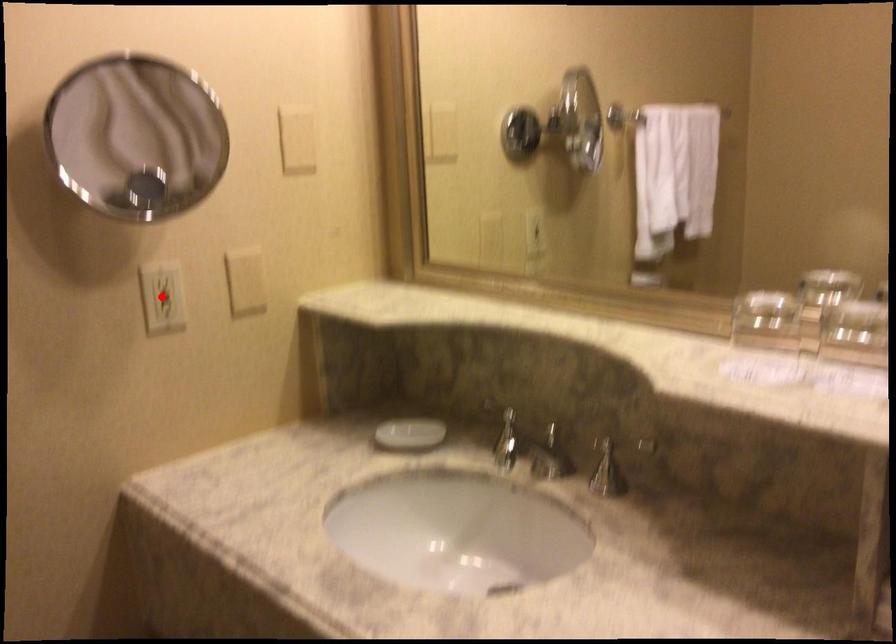
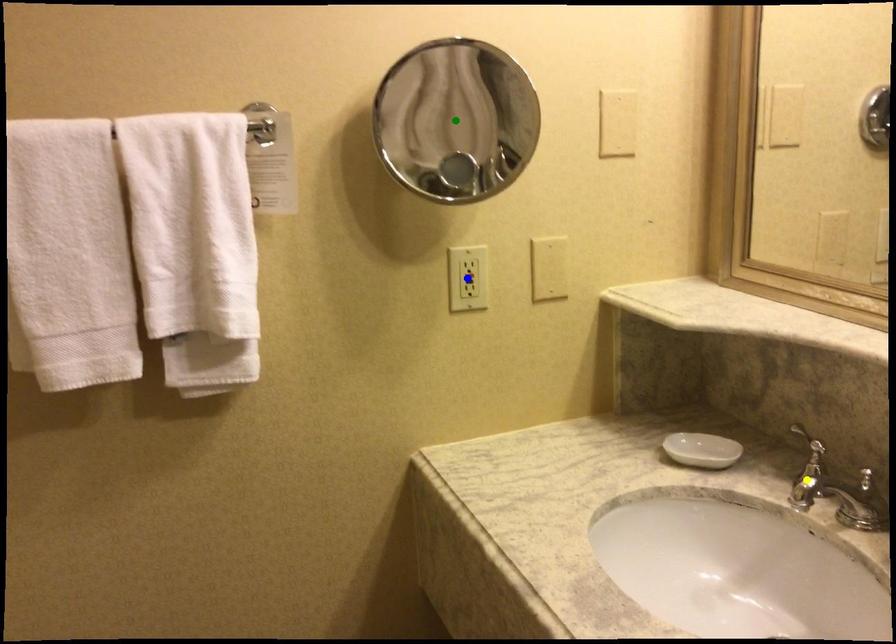
Question: I am providing you with two images of the same scene from different viewpoints. A red point is marked on the first image. You are given multiple points on the second image. In image 2, which mark is for the same physical point as the one in image 1?

Choices:
 (A) blue point
 (B) green point
 (C) yellow point

Answer: (A)